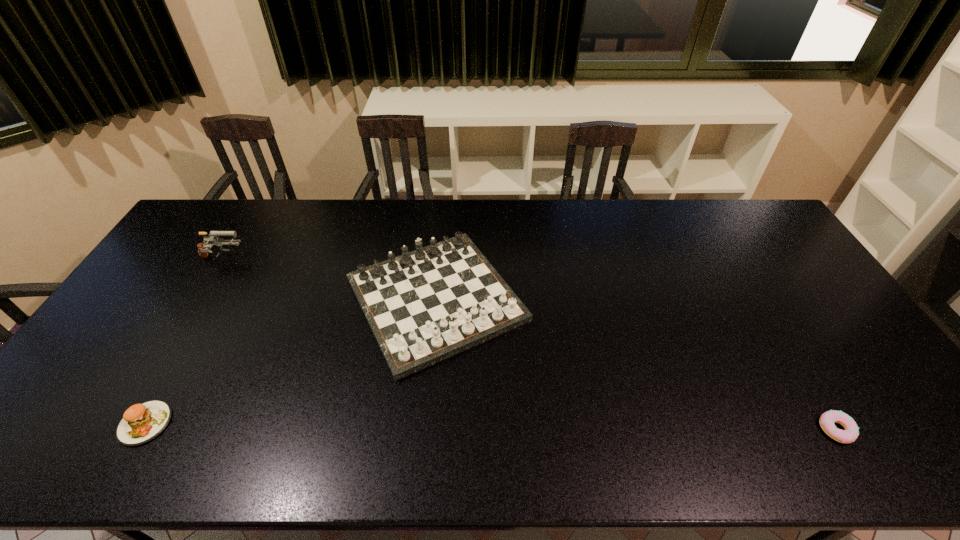
You are a GUI agent. You are given a task and a screenshot of the screen. Output one action in this format:
    pyautogui.click(x=<x>, y=<y>)
    Task: Click on the patty that is at the near edge
    
    Given the screenshot: What is the action you would take?
    pyautogui.click(x=141, y=423)

At what (x,y) coordinates should I click in order to perform the action: click on doughnut at the near edge. Please return your answer as a coordinate pair (x, y). Looking at the image, I should click on (827, 419).

Locate an element on the screen. This screenshot has width=960, height=540. object situated at the left edge is located at coordinates (203, 248).

At what (x,y) coordinates should I click in order to perform the action: click on vacant space at the far edge of the desktop. Please return your answer as a coordinate pair (x, y). Looking at the image, I should click on (381, 210).

At what (x,y) coordinates should I click in order to perform the action: click on vacant region at the near edge of the desktop. Please return your answer as a coordinate pair (x, y). Looking at the image, I should click on (114, 465).

Where is `vacant region at the left edge of the desktop`? The width and height of the screenshot is (960, 540). vacant region at the left edge of the desktop is located at coordinates (117, 357).

In the image, there is a desktop. Where is `vacant space at the right edge`? vacant space at the right edge is located at coordinates (848, 382).

You are a GUI agent. You are given a task and a screenshot of the screen. Output one action in this format:
    pyautogui.click(x=<x>, y=<y>)
    Task: Click on the vacant space at the far right corner of the desktop
    The width and height of the screenshot is (960, 540).
    Given the screenshot: What is the action you would take?
    pyautogui.click(x=720, y=216)

This screenshot has height=540, width=960. In order to click on free area in between the second shortest object and the doughnut in this screenshot , I will do `click(491, 426)`.

Where is `free space between the shortest object and the gun`? Image resolution: width=960 pixels, height=540 pixels. free space between the shortest object and the gun is located at coordinates (529, 345).